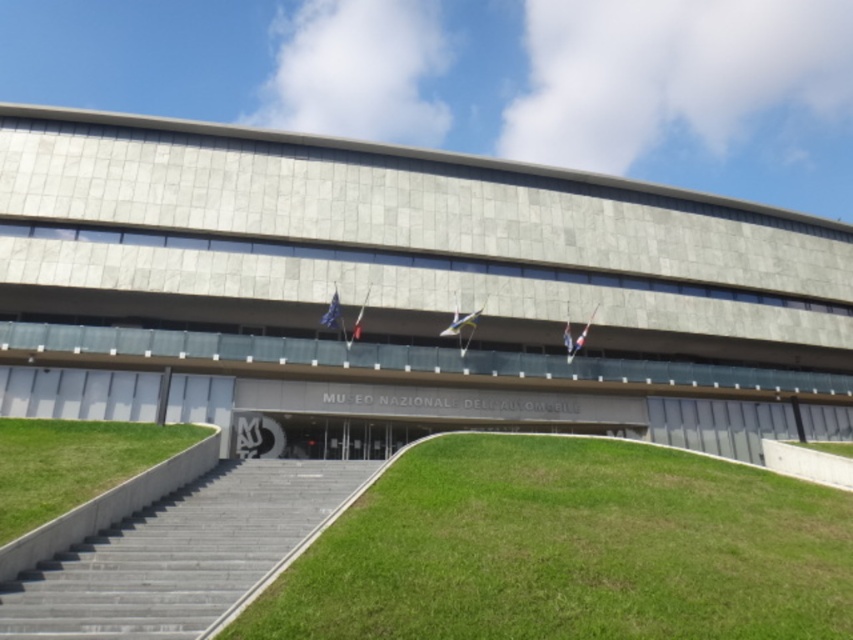
Looking at this image, does green grass at lower center have a greater width compared to gray concrete stairs at center?

Correct, the width of green grass at lower center exceeds that of gray concrete stairs at center.

Who is more forward, (320, 632) or (28, 600)?

Point (320, 632) is in front.

Is point (549, 636) closer to viewer compared to point (242, 528)?

Yes, it is.

Where is `green grass at lower center`? green grass at lower center is located at coordinates pos(567,548).

In the scene shown: Is green grass at lower center to the left of green grass at lower left from the viewer's perspective?

No, green grass at lower center is not to the left of green grass at lower left.

The width and height of the screenshot is (853, 640). Describe the element at coordinates (567, 548) in the screenshot. I see `green grass at lower center` at that location.

Describe the element at coordinates (567, 548) in the screenshot. This screenshot has width=853, height=640. I see `green grass at lower center` at that location.

At what (x,y) coordinates should I click in order to perform the action: click on green grass at lower center. Please return your answer as a coordinate pair (x, y). This screenshot has height=640, width=853. Looking at the image, I should click on (567, 548).

The width and height of the screenshot is (853, 640). Identify the location of gray concrete stairs at center. (178, 554).

Is point (61, 582) farther from camera compared to point (115, 515)?

No, (61, 582) is closer to viewer.

What do you see at coordinates (178, 554) in the screenshot? I see `gray concrete stairs at center` at bounding box center [178, 554].

This screenshot has width=853, height=640. Identify the location of gray concrete stairs at center. (178, 554).